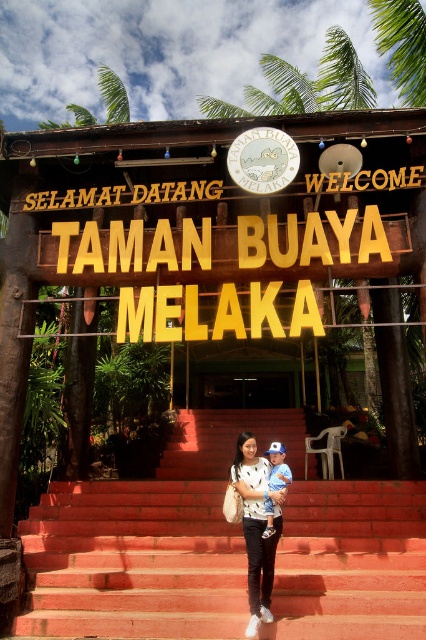
Looking at this image, you are standing at the entrance of Taman Buaya Melaka and see both the red brick stairs at center and the blue cotton shirt at center. Which object is bigger in size?

The red brick stairs at center has a larger size compared to the blue cotton shirt at center.

You are a visitor at the entrance of Taman Buaya Melaka and notice the red brick stairs at center and the white matte dress at center. Which object is positioned lower from your viewpoint?

The red brick stairs at center is located below the white matte dress at center, so the red brick stairs at center is positioned lower from your viewpoint.